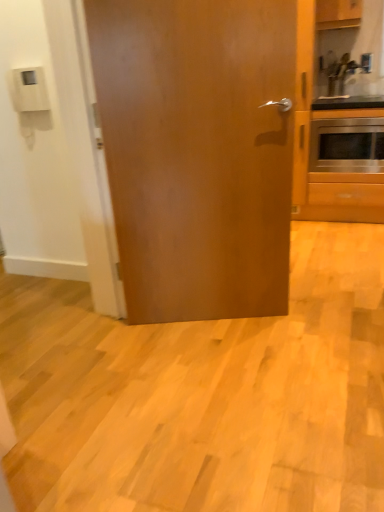
The width and height of the screenshot is (384, 512). I want to click on vacant area situated below glossy wood door at center (from a real-world perspective), so click(x=210, y=320).